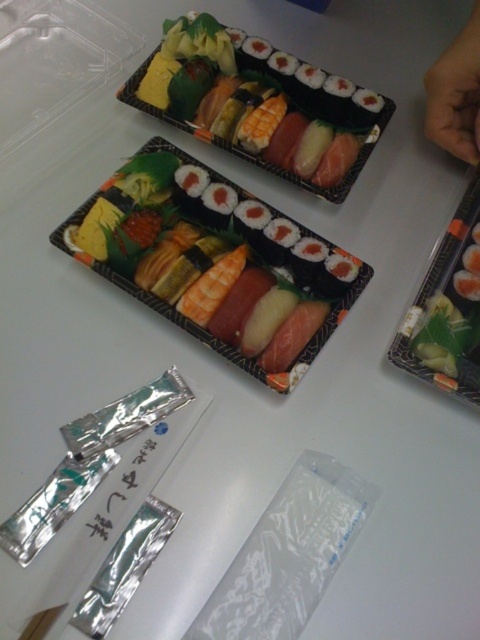
You are a customer at a sushi bar and see the transparent plastic bag at lower center and the skinny hand at upper right. Which object is closer to you?

The transparent plastic bag at lower center is below the skinny hand at upper right, so the skinny hand at upper right is closer to you.

You are a customer at a sushi restaurant. You want to order the sushi located at point (216, 260). Can you tell me what sushi is at that point?

The point (216, 260) is on shiny black sushi at center, so the sushi at that point is the shiny black sushi at center.

You are a customer at a sushi bar and see the shiny black sushi at center on the tray. If you want to point to its exact location, what coordinates should you mention?

The shiny black sushi at center is located at coordinates point (216, 260).